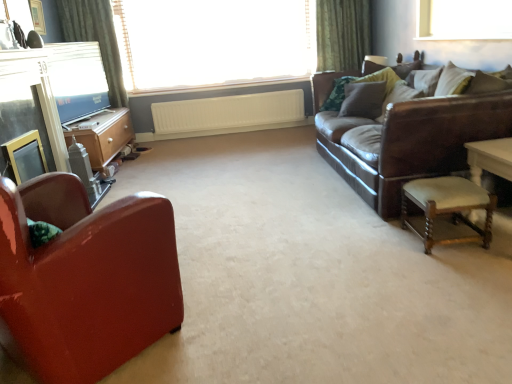
The height and width of the screenshot is (384, 512). I want to click on wooden upholstered stool at right, so click(447, 208).

How much space does velvet brown pillow at upper right, which ranks as the first pillow in right-to-left order, occupy horizontally?

velvet brown pillow at upper right, which ranks as the first pillow in right-to-left order, is 10.14 inches wide.

In order to face white glass window at upper right, the second window positioned from the back, should I rotate leftwards or rightwards?

Turn right by 26.317 degrees to look at white glass window at upper right, the second window positioned from the back.

Measure the distance between point (458, 18) and camera.

Point (458, 18) and camera are 10.97 feet apart.

What do you see at coordinates (102, 135) in the screenshot?
I see `wooden dresser at left` at bounding box center [102, 135].

This screenshot has width=512, height=384. Identify the location of wooden upholstered stool at right. (447, 208).

Which of these two, leather couch at right or white textured curtain at upper center, which ranks as the second window in front-to-back order, is wider?

Wider between the two is leather couch at right.

Does leather couch at right have a smaller size compared to white textured curtain at upper center, the first window viewed from the left?

No, leather couch at right is not smaller than white textured curtain at upper center, the first window viewed from the left.

Is leather couch at right not near white textured curtain at upper center, marked as the 2th window in a right-to-left arrangement?

Yes, leather couch at right and white textured curtain at upper center, marked as the 2th window in a right-to-left arrangement, are quite far apart.

Which is in front, point (405, 168) or point (265, 34)?

The point (405, 168) is closer.

Where is `chair that appears below the white textured curtain at upper center, which ranks as the second window in front-to-back order (from a real-world perspective)`? The height and width of the screenshot is (384, 512). chair that appears below the white textured curtain at upper center, which ranks as the second window in front-to-back order (from a real-world perspective) is located at coordinates (85, 279).

From a real-world perspective, is glossy red armchair at left on top of white textured curtain at upper center, which ranks as the second window in front-to-back order?

No.

Considering the relative sizes of glossy red armchair at left and white textured curtain at upper center, which ranks as the second window in front-to-back order, in the image provided, is glossy red armchair at left shorter than white textured curtain at upper center, which ranks as the second window in front-to-back order,?

Yes.

Is glossy red armchair at left closer to camera compared to white textured curtain at upper center, the first window viewed from the left?

Yes, it is.

From the image's perspective, who appears lower, white textured radiator at center or white textured curtain at upper center, the 1th window in the back-to-front sequence?

From the image's view, white textured radiator at center is below.

From a real-world perspective, between white textured radiator at center and white textured curtain at upper center, the first window viewed from the left, who is vertically higher?

In real-world perspective, white textured curtain at upper center, the first window viewed from the left, is above.

Image resolution: width=512 pixels, height=384 pixels. What are the coordinates of `radiator below the white textured curtain at upper center, which ranks as the second window in front-to-back order (from the image's perspective)` in the screenshot? It's located at (228, 114).

Is wooden dresser at left surrounded by white textured curtain at upper center, the first window viewed from the left?

Result: No, wooden dresser at left is not surrounded by white textured curtain at upper center, the first window viewed from the left.

Considering the points (195, 41) and (89, 154), which point is behind, point (195, 41) or point (89, 154)?

The point (195, 41) is behind.

From their relative heights in the image, would you say white textured curtain at upper center, marked as the 2th window in a right-to-left arrangement, is taller or shorter than wooden dresser at left?

In the image, white textured curtain at upper center, marked as the 2th window in a right-to-left arrangement, appears to be taller than wooden dresser at left.

In the scene shown: From a real-world perspective, who is located lower, white textured curtain at upper center, marked as the 2th window in a right-to-left arrangement, or wooden dresser at left?

In real-world perspective, wooden dresser at left is lower.

Which of these two, velvet brown pillow at upper right, which ranks as the first pillow in right-to-left order, or white textured radiator at center, stands taller?

white textured radiator at center is taller.

Considering the relative sizes of velvet brown pillow at upper right, which ranks as the first pillow in right-to-left order, and white textured radiator at center in the image provided, is velvet brown pillow at upper right, which ranks as the first pillow in right-to-left order, smaller than white textured radiator at center?

Correct, velvet brown pillow at upper right, which ranks as the first pillow in right-to-left order, occupies less space than white textured radiator at center.

Does point (400, 94) appear closer or farther from the camera than point (259, 99)?

Point (400, 94) is closer to the camera than point (259, 99).

Considering the relative sizes of velvet brown pillow at upper right, which ranks as the first pillow in right-to-left order, and white textured radiator at center in the image provided, is velvet brown pillow at upper right, which ranks as the first pillow in right-to-left order, thinner than white textured radiator at center?

No, velvet brown pillow at upper right, which ranks as the first pillow in right-to-left order, is not thinner than white textured radiator at center.

Considering the sizes of objects leather couch at right and glossy red armchair at left in the image provided, who is shorter, leather couch at right or glossy red armchair at left?

glossy red armchair at left.

Looking at this image, from the image's perspective, is leather couch at right positioned above or below glossy red armchair at left?

leather couch at right is situated higher than glossy red armchair at left in the image.

From a real-world perspective, between leather couch at right and glossy red armchair at left, who is vertically lower?

glossy red armchair at left.

Does leather couch at right have a smaller size compared to glossy red armchair at left?

Incorrect, leather couch at right is not smaller in size than glossy red armchair at left.

Is white textured curtain at upper center, marked as the 2th window in a right-to-left arrangement, behind glossy red armchair at left?

Yes, white textured curtain at upper center, marked as the 2th window in a right-to-left arrangement, is behind glossy red armchair at left.

Measure the distance from white textured curtain at upper center, the first window viewed from the left, to glossy red armchair at left.

The distance of white textured curtain at upper center, the first window viewed from the left, from glossy red armchair at left is 13.58 feet.

Considering the relative positions of white textured curtain at upper center, the first window viewed from the left, and glossy red armchair at left in the image provided, is white textured curtain at upper center, the first window viewed from the left, to the right of glossy red armchair at left from the viewer's perspective?

Indeed, white textured curtain at upper center, the first window viewed from the left, is positioned on the right side of glossy red armchair at left.

Locate an element on the screen. The width and height of the screenshot is (512, 384). the 2nd window behind the leather couch at right, counting from the anchor's position is located at coordinates (214, 42).

The width and height of the screenshot is (512, 384). What are the coordinates of `chair below the white textured curtain at upper center, marked as the 2th window in a right-to-left arrangement (from a real-world perspective)` in the screenshot? It's located at (85, 279).

Considering their positions, is white textured radiator at center positioned further to green fabric curtain at upper left than wooden dresser at left?

white textured radiator at center is further to green fabric curtain at upper left.

Estimate the real-world distances between objects in this image. Which object is closer to wooden upholstered stool at right, leather couch at right or white textured radiator at center?

leather couch at right is positioned closer to the anchor wooden upholstered stool at right.

Estimate the real-world distances between objects in this image. Which object is further from wooden upholstered stool at right, green fabric curtain at upper left or leather couch at right?

The object further to wooden upholstered stool at right is green fabric curtain at upper left.

Which object lies further to the anchor point matte black fireplace at left, wooden upholstered stool at right or white textured radiator at center?

wooden upholstered stool at right is positioned further to the anchor matte black fireplace at left.

Which object lies nearer to the anchor point wooden dresser at left, velvet brown pillow at upper right, which ranks as the first pillow in right-to-left order, or white glass window at upper right, the first window when ordered from front to back?

Among the two, velvet brown pillow at upper right, which ranks as the first pillow in right-to-left order, is located nearer to wooden dresser at left.

Which object lies nearer to the anchor point velvet brown pillow at upper right, the 1th pillow in the left-to-right sequence, wooden upholstered stool at right or glossy red armchair at left?

Among the two, wooden upholstered stool at right is located nearer to velvet brown pillow at upper right, the 1th pillow in the left-to-right sequence.

From the image, which object appears to be nearer to white textured radiator at center, velvet brown pillow at upper right, which ranks as the first pillow in right-to-left order, or leather couch at right?

leather couch at right.

When comparing their distances from velvet brown pillow at upper right, which is the 2th pillow from right to left, does wooden dresser at left or matte black tv at upper left seem further?

Among the two, matte black tv at upper left is located further to velvet brown pillow at upper right, which is the 2th pillow from right to left.

The width and height of the screenshot is (512, 384). Find the location of `window between leather couch at right and velvet brown pillow at upper right, acting as the second pillow starting from the left, from front to back`. window between leather couch at right and velvet brown pillow at upper right, acting as the second pillow starting from the left, from front to back is located at coordinates (464, 20).

Locate an element on the screen. This screenshot has height=384, width=512. window screen between glossy red armchair at left and wooden dresser at left in the front-back direction is located at coordinates (77, 79).

The image size is (512, 384). I want to click on studio couch that lies between white glass window at upper right, the first window when ordered from front to back, and wooden upholstered stool at right from top to bottom, so click(406, 137).

Image resolution: width=512 pixels, height=384 pixels. In order to click on studio couch between green fabric curtain at upper left and velvet brown pillow at upper right, acting as the second pillow starting from the left, from left to right in this screenshot , I will do `click(406, 137)`.